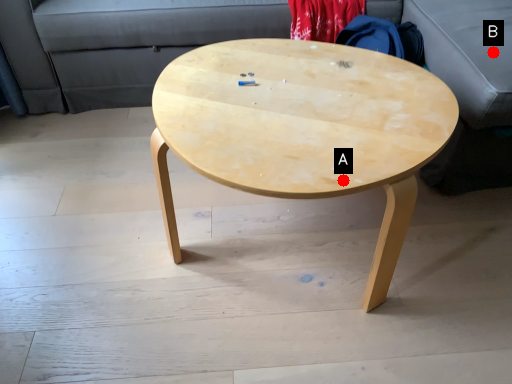
Question: Two points are circled on the image, labeled by A and B beside each circle. Among these points, which one is farthest from the camera?

Choices:
 (A) A is further
 (B) B is further

Answer: (B)